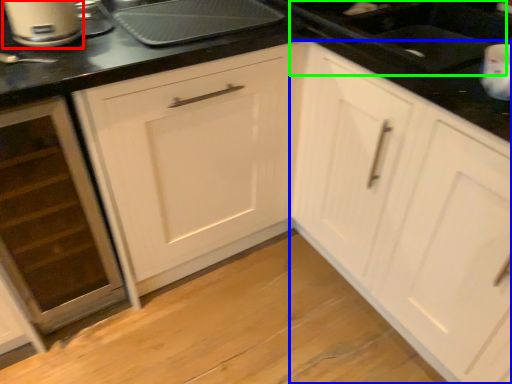
Question: Considering the real-world distances, which object is farthest from home appliance (highlighted by a red box)? cabinetry (highlighted by a blue box) or sink (highlighted by a green box)?

Choices:
 (A) cabinetry
 (B) sink

Answer: (A)